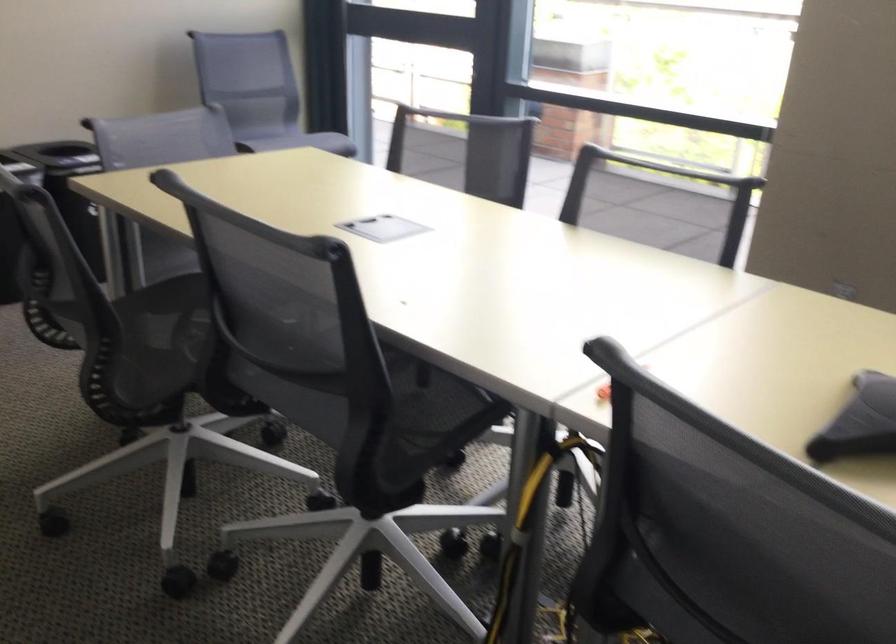
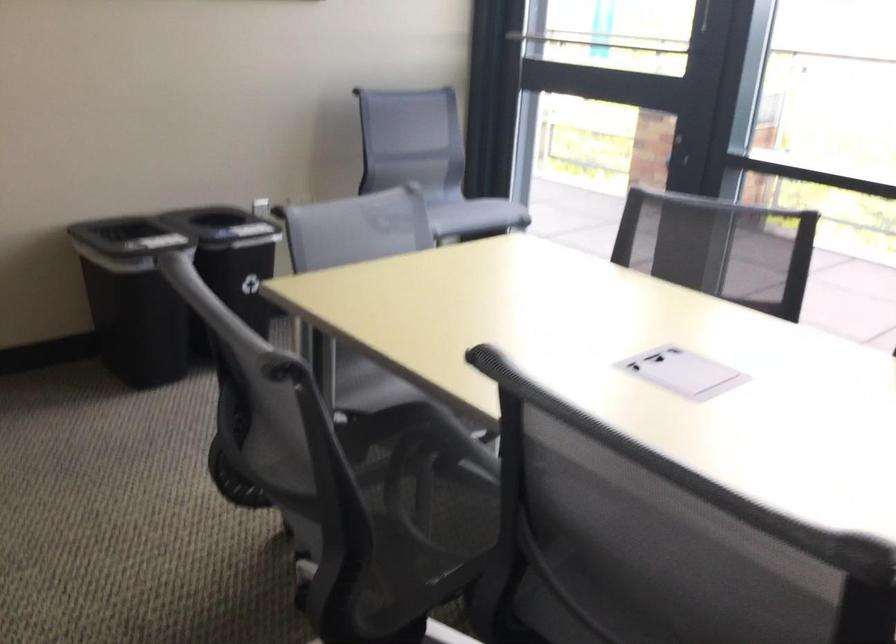
Locate, in the second image, the point that corresponds to (197,316) in the first image.

(421, 480)